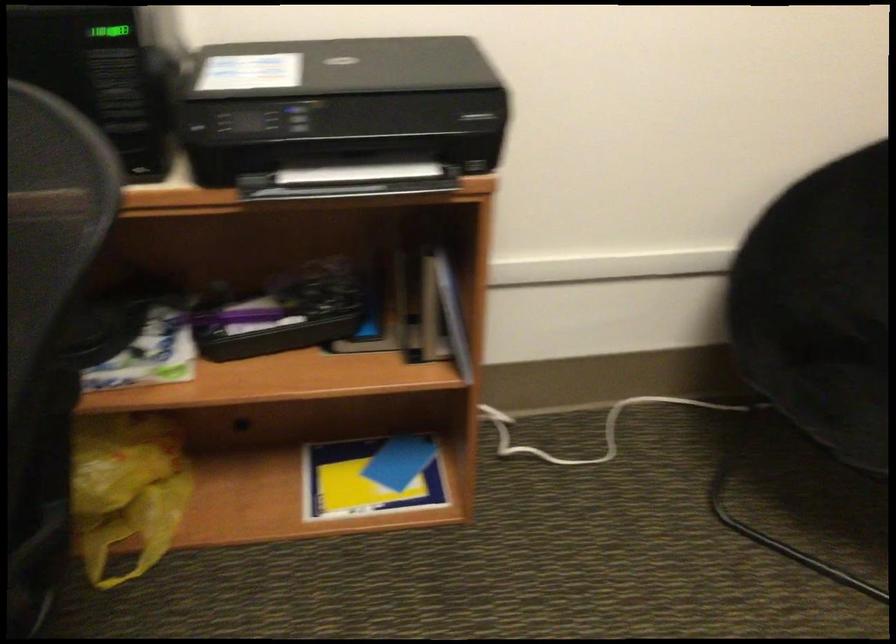
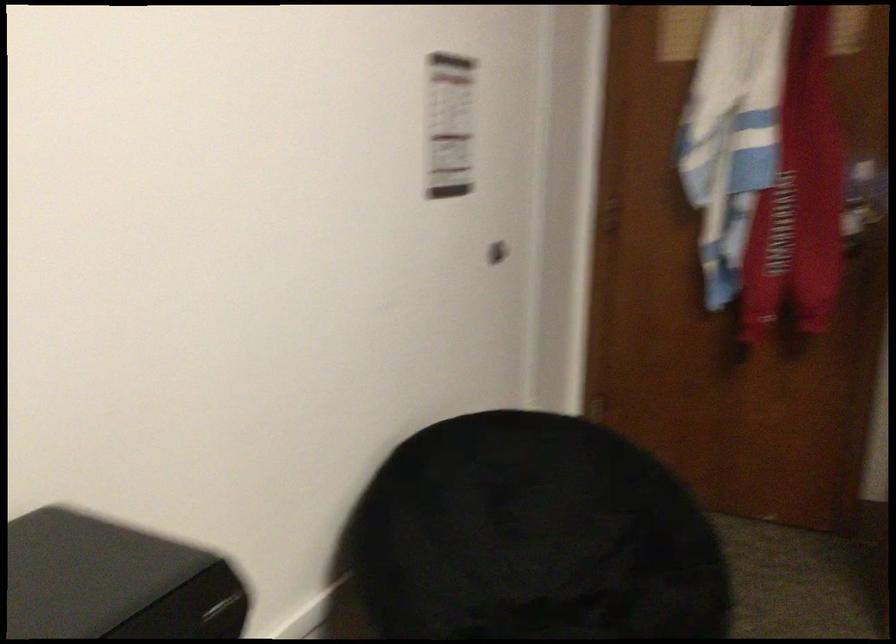
Question: The camera is either moving clockwise (left) or counter-clockwise (right) around the object. The first image is from the beginning of the video and the second image is from the end. Is the camera moving left or right when shooting the video?

Choices:
 (A) Left
 (B) Right

Answer: (A)